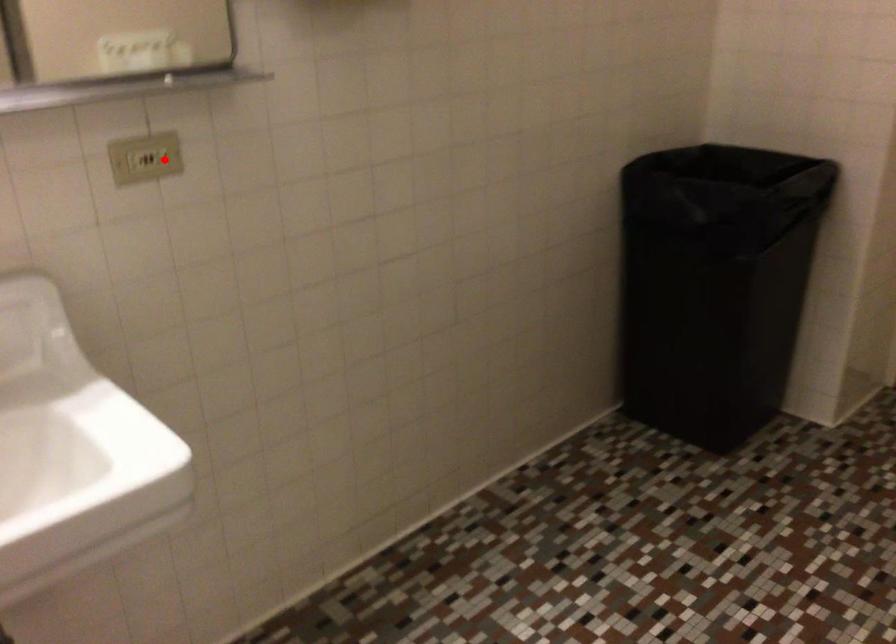
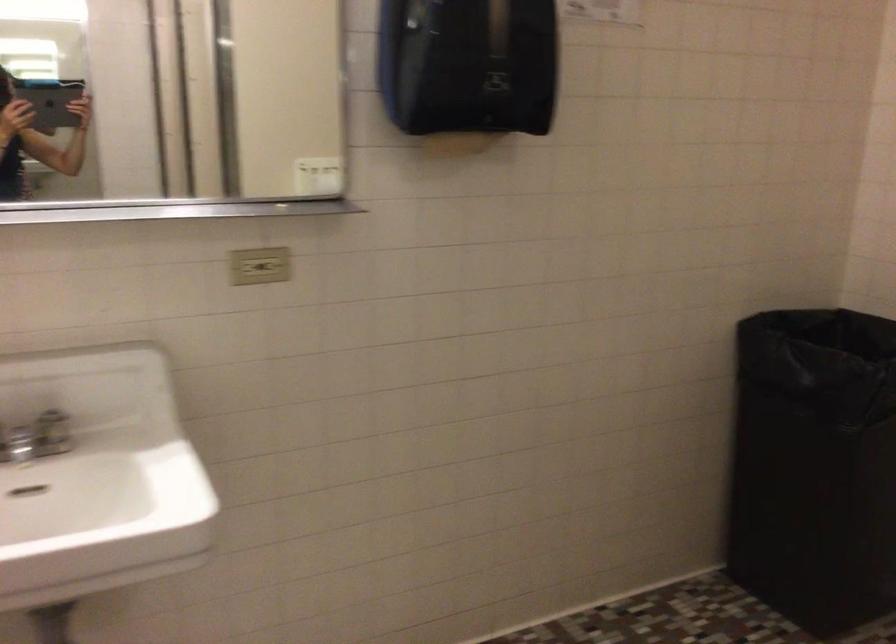
Question: I am providing you with two images of the same scene from different viewpoints. A red point is shown in image1. For the corresponding object point in image2, is it positioned nearer or farther from the camera?

Choices:
 (A) Nearer
 (B) Farther

Answer: (B)